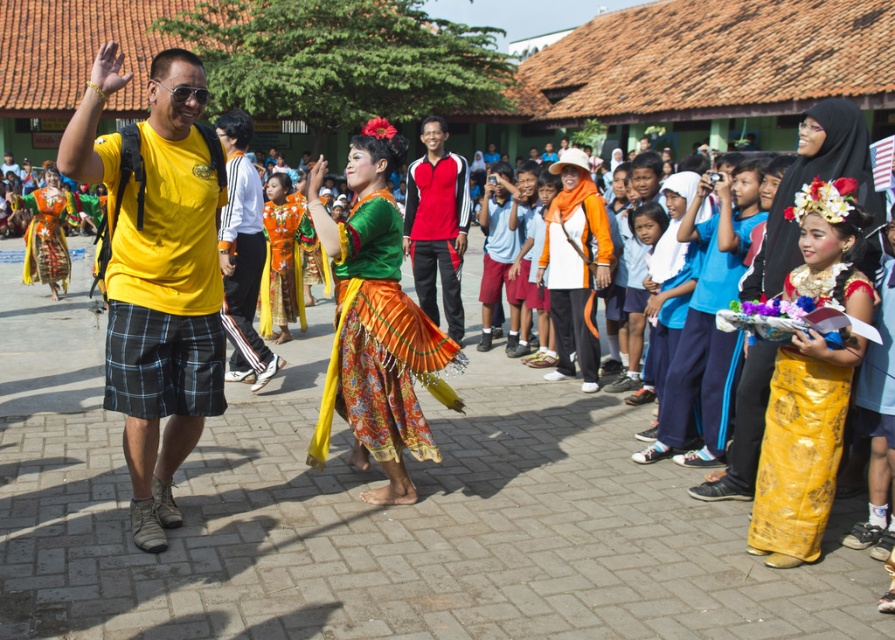
Does point (791, 394) come in front of point (857, 124)?

Yes.

Does shiny yellow skirt at right have a smaller size compared to yellow satin dress at right?

Correct, shiny yellow skirt at right occupies less space than yellow satin dress at right.

Where is `shiny yellow skirt at right`? The width and height of the screenshot is (895, 640). shiny yellow skirt at right is located at coordinates (800, 445).

Is shiny yellow skirt at right closer to the viewer compared to red and black sportswear at center?

That is True.

Which is behind, point (824, 216) or point (430, 262)?

Positioned behind is point (430, 262).

At what (x,y) coordinates should I click in order to perform the action: click on shiny yellow skirt at right. Please return your answer as a coordinate pair (x, y). This screenshot has width=895, height=640. Looking at the image, I should click on (800, 445).

Is yellow plaid shorts at left above shiny yellow skirt at right?

Correct, yellow plaid shorts at left is located above shiny yellow skirt at right.

Does yellow plaid shorts at left have a lesser width compared to shiny yellow skirt at right?

Incorrect, yellow plaid shorts at left's width is not less than shiny yellow skirt at right's.

Between point (117, 84) and point (789, 508), which one is positioned behind?

Positioned behind is point (789, 508).

The width and height of the screenshot is (895, 640). I want to click on yellow plaid shorts at left, so click(x=158, y=273).